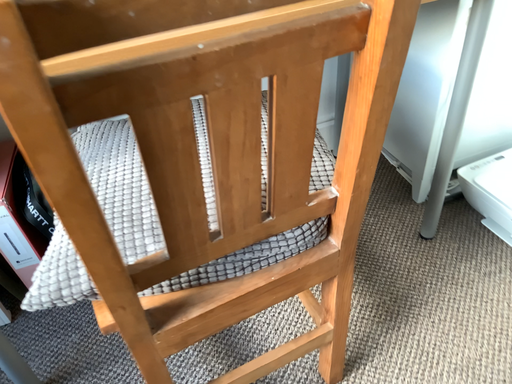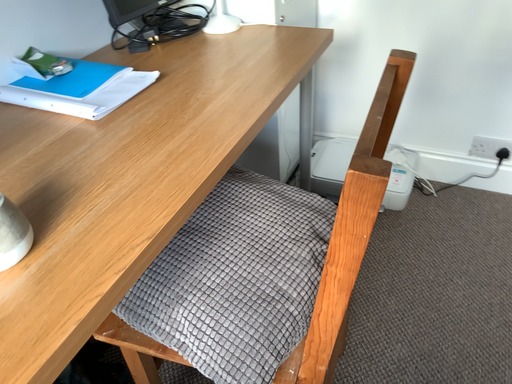
Question: How did the camera likely rotate when shooting the video?

Choices:
 (A) rotated left
 (B) rotated right

Answer: (B)